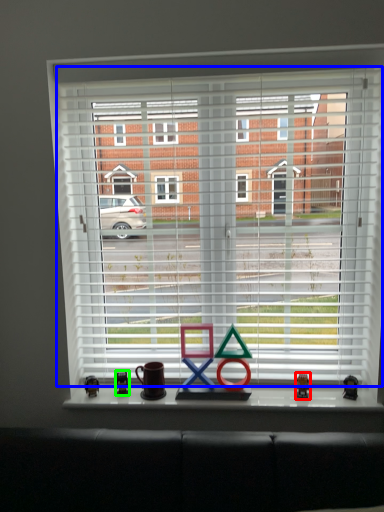
Question: Estimate the real-world distances between objects in this image. Which object is farther from miniature (highlighted by a red box), window blind (highlighted by a blue box) or miniature (highlighted by a green box)?

Choices:
 (A) window blind
 (B) miniature

Answer: (A)